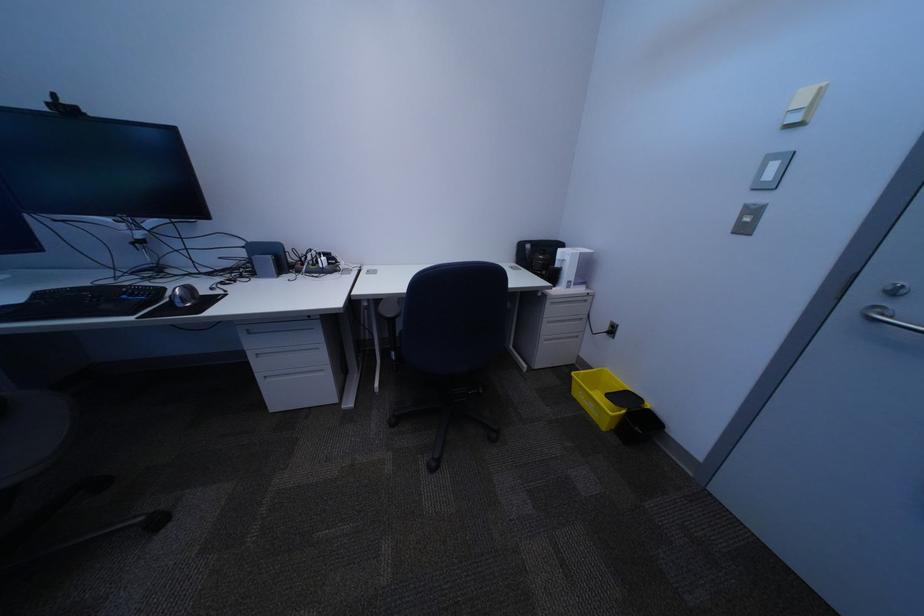
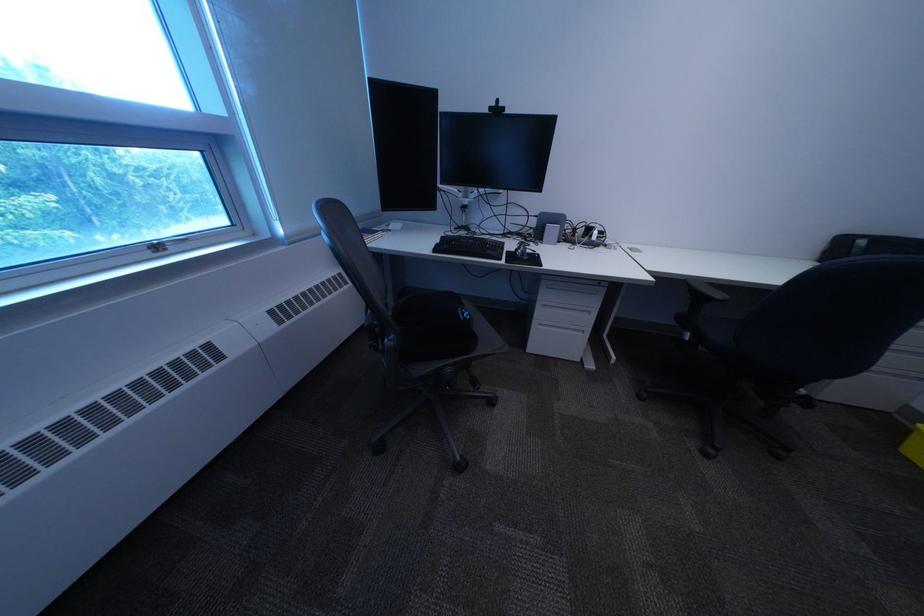
Where in the second image is the point corresponding to the point at 273,357 from the first image?

(558, 307)